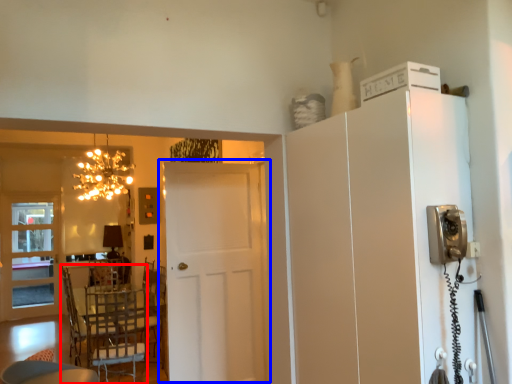
Question: Which object appears farthest to the camera in this image, chair (highlighted by a red box) or door (highlighted by a blue box)?

Choices:
 (A) chair
 (B) door

Answer: (A)